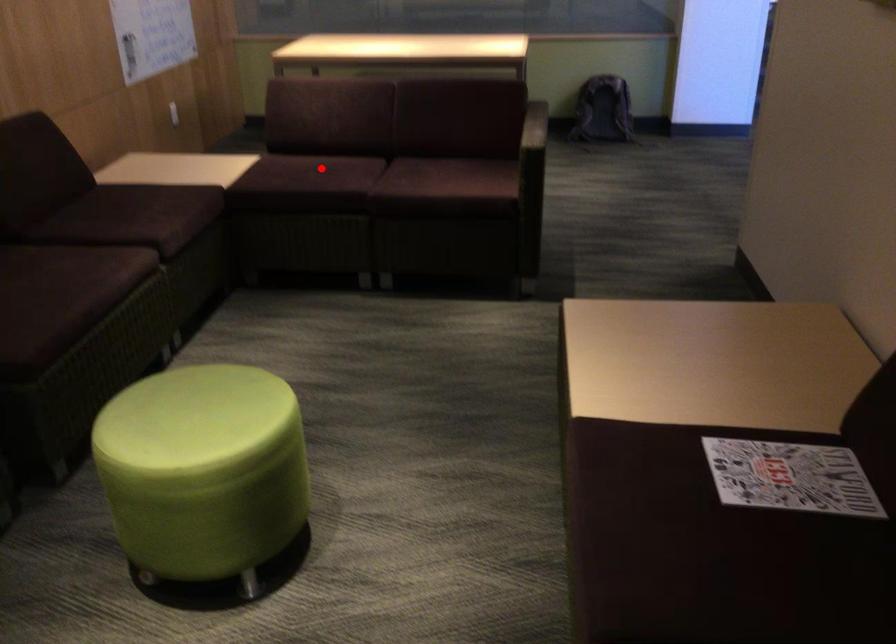
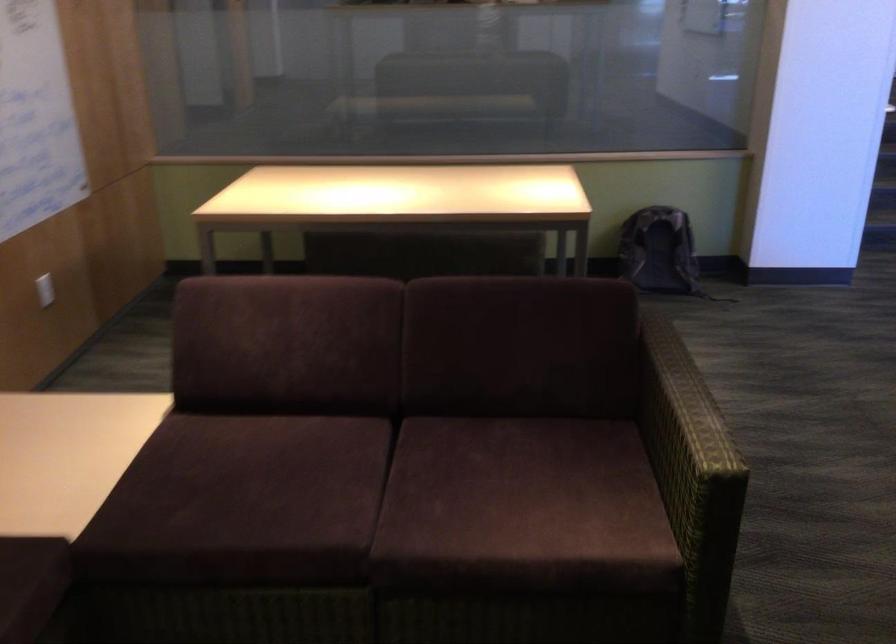
Question: I am providing you with two images of the same scene from different viewpoints. In image1, a red point is highlighted. Considering the same 3D point in image2, which of the following is correct?

Choices:
 (A) It is closer
 (B) It is farther

Answer: (A)